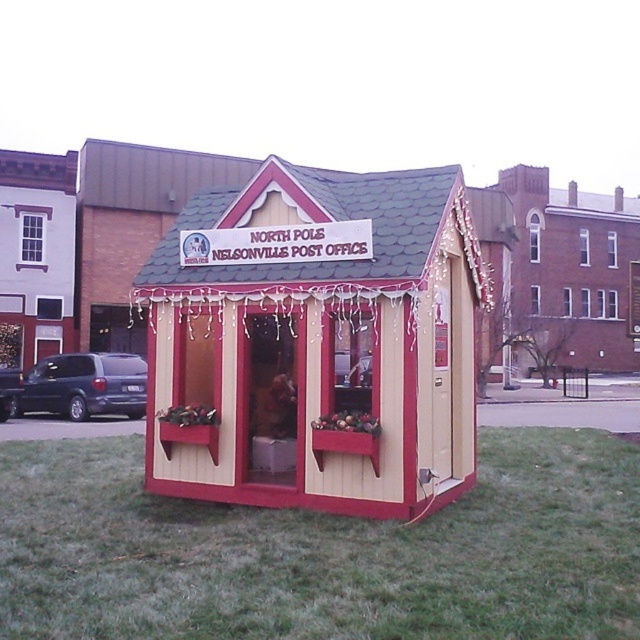
Based on the photo, does wooden cabin at center have a greater height compared to matte dark blue van at left?

No, wooden cabin at center is not taller than matte dark blue van at left.

Is wooden cabin at center below matte dark blue van at left?

No.

Is point (156, 417) farther from viewer compared to point (125, 392)?

No, it is not.

The height and width of the screenshot is (640, 640). What are the coordinates of `wooden cabin at center` in the screenshot? It's located at (316, 342).

Does brick building at center appear on the left side of dark blue matte van at left?

No, brick building at center is not to the left of dark blue matte van at left.

Does brick building at center have a smaller size compared to dark blue matte van at left?

Actually, brick building at center might be larger than dark blue matte van at left.

The image size is (640, 640). Find the location of `brick building at center`. brick building at center is located at coordinates (572, 273).

Can you confirm if brick building at center is bigger than matte dark blue van at left?

Yes, brick building at center is bigger than matte dark blue van at left.

Can you confirm if brick building at center is positioned below matte dark blue van at left?

No, brick building at center is not below matte dark blue van at left.

I want to click on brick building at center, so click(572, 273).

Find the location of `brick building at center`. brick building at center is located at coordinates (572, 273).